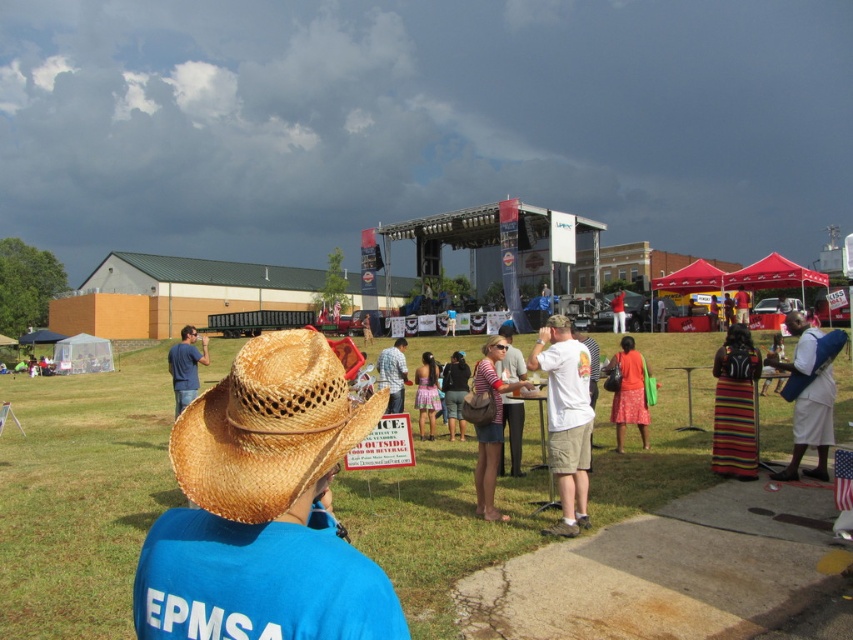
Is striped fabric dress at lower right to the left of striped cotton shirt at center from the viewer's perspective?

In fact, striped fabric dress at lower right is to the right of striped cotton shirt at center.

From the picture: Does striped fabric dress at lower right have a lesser width compared to striped cotton shirt at center?

Correct, striped fabric dress at lower right's width is less than striped cotton shirt at center's.

Who is more forward, (717,396) or (492,384)?

Point (492,384) is more forward.

Image resolution: width=853 pixels, height=640 pixels. Find the location of `striped fabric dress at lower right`. striped fabric dress at lower right is located at coordinates (734, 404).

Which is below, striped cotton shirt at center or matte brown cowboy hat at center?

matte brown cowboy hat at center is below.

Consider the image. Between striped cotton shirt at center and matte brown cowboy hat at center, which one has less height?

Standing shorter between the two is matte brown cowboy hat at center.

This screenshot has height=640, width=853. I want to click on striped cotton shirt at center, so click(491, 426).

Who is shorter, white cotton shirt at center or striped cotton shirt at center?

Standing shorter between the two is striped cotton shirt at center.

Does white cotton shirt at center come behind striped cotton shirt at center?

No, white cotton shirt at center is closer to the viewer.

Who is more distant from viewer, (585, 481) or (479, 481)?

The point (479, 481) is behind.

This screenshot has height=640, width=853. Identify the location of white cotton shirt at center. (566, 419).